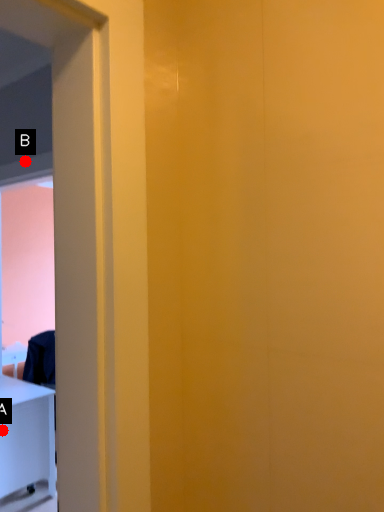
Question: Two points are circled on the image, labeled by A and B beside each circle. Which point is farther to the camera?

Choices:
 (A) A is further
 (B) B is further

Answer: (A)